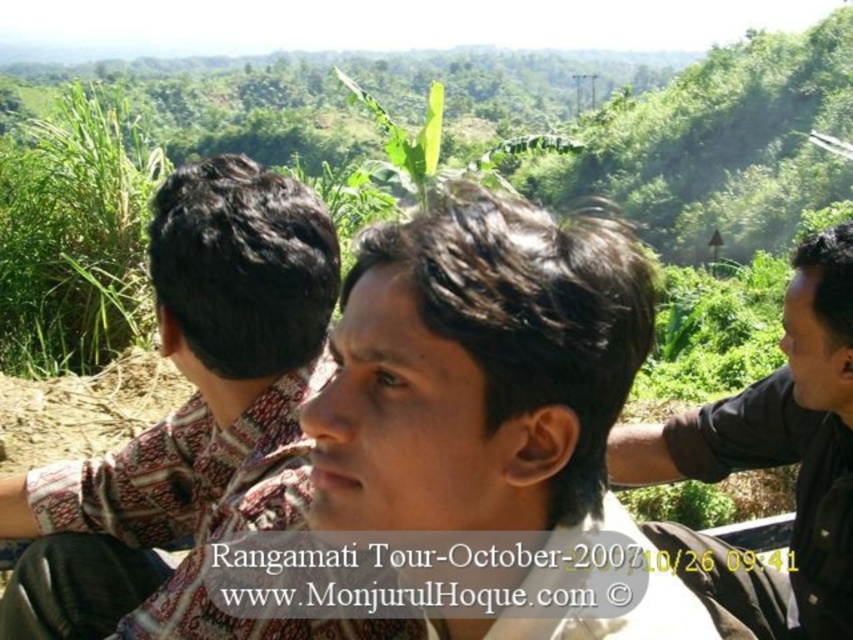
You are standing in a rural area and see the green leafy plant at center and the black matte shirt at right. Which object is higher in the image?

The green leafy plant at center is above the black matte shirt at right, so the green leafy plant at center is higher in the image.

You are a photographer trying to capture a photo of the black matte shirt at right and the green leafy plant at center. Which object should you focus on first if you want to ensure both are in sharp focus?

The green leafy plant at center is taller than the black matte shirt at right, so focusing on the green leafy plant at center would help ensure both are in sharp focus.